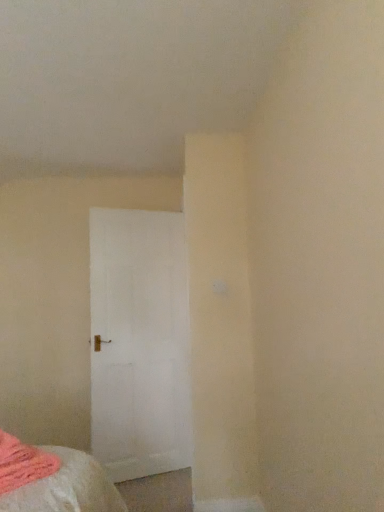
The image size is (384, 512). Describe the element at coordinates (139, 342) in the screenshot. I see `white matte door at center` at that location.

From the picture: What is the approximate height of white matte door at center?

white matte door at center is 6.52 feet tall.

Locate an element on the screen. The image size is (384, 512). white matte door at center is located at coordinates (139, 342).

Where is `soft pink fabric at lower left`? This screenshot has width=384, height=512. soft pink fabric at lower left is located at coordinates (23, 463).

What do you see at coordinates (23, 463) in the screenshot?
I see `soft pink fabric at lower left` at bounding box center [23, 463].

Where is `white matte door at center`? white matte door at center is located at coordinates (139, 342).

Does white matte door at center appear on the right side of soft pink fabric at lower left?

Correct, you'll find white matte door at center to the right of soft pink fabric at lower left.

Which object is closer to the camera, white matte door at center or soft pink fabric at lower left?

Positioned in front is soft pink fabric at lower left.

Between point (109, 231) and point (49, 459), which one is positioned behind?

The point (109, 231) is more distant.

From the image's perspective, is white matte door at center beneath soft pink fabric at lower left?

No, from the image's perspective, white matte door at center is not below soft pink fabric at lower left.

From a real-world perspective, is white matte door at center located higher than soft pink fabric at lower left?

Correct, in the physical world, white matte door at center is higher than soft pink fabric at lower left.

Between white matte door at center and soft pink fabric at lower left, which one has smaller width?

white matte door at center.

In the scene shown: Considering the sizes of objects white matte door at center and soft pink fabric at lower left in the image provided, who is shorter, white matte door at center or soft pink fabric at lower left?

soft pink fabric at lower left is shorter.

Considering the relative sizes of white matte door at center and soft pink fabric at lower left in the image provided, is white matte door at center bigger than soft pink fabric at lower left?

Yes.

Could soft pink fabric at lower left be considered to be inside white matte door at center?

No.

Is white matte door at center next to soft pink fabric at lower left and touching it?

No, white matte door at center is not next to soft pink fabric at lower left.

Could you tell me if white matte door at center is turned towards soft pink fabric at lower left?

No.

Can you tell me how much white matte door at center and soft pink fabric at lower left differ in facing direction?

The angle between the facing direction of white matte door at center and the facing direction of soft pink fabric at lower left is 68.6 degrees.

Measure the distance between white matte door at center and soft pink fabric at lower left.

They are 1.68 meters apart.

Find the location of `blanket lying in front of the white matte door at center`. blanket lying in front of the white matte door at center is located at coordinates (23, 463).

Is soft pink fabric at lower left to the left of white matte door at center from the viewer's perspective?

Indeed, soft pink fabric at lower left is positioned on the left side of white matte door at center.

Which object is closer to the camera, soft pink fabric at lower left or white matte door at center?

soft pink fabric at lower left is closer to the camera.

Which is closer to the camera, (36, 463) or (186, 449)?

Point (36, 463) is positioned closer to the camera compared to point (186, 449).

From the image's perspective, which object appears higher, soft pink fabric at lower left or white matte door at center?

From the image's view, white matte door at center is above.

From a real-world perspective, does soft pink fabric at lower left sit lower than white matte door at center?

Yes, from a real-world perspective, soft pink fabric at lower left is under white matte door at center.

Can you confirm if soft pink fabric at lower left is thinner than white matte door at center?

No.

Does soft pink fabric at lower left have a greater height compared to white matte door at center?

Incorrect, the height of soft pink fabric at lower left is not larger of that of white matte door at center.

Considering the relative sizes of soft pink fabric at lower left and white matte door at center in the image provided, is soft pink fabric at lower left bigger than white matte door at center?

Actually, soft pink fabric at lower left might be smaller than white matte door at center.

Is soft pink fabric at lower left situated inside white matte door at center or outside?

soft pink fabric at lower left is outside white matte door at center.

Are soft pink fabric at lower left and white matte door at center far apart?

Yes, soft pink fabric at lower left and white matte door at center are quite far apart.

Is soft pink fabric at lower left oriented away from white matte door at center?

Yes, soft pink fabric at lower left's orientation is away from white matte door at center.

Can you tell me how much soft pink fabric at lower left and white matte door at center differ in facing direction?

68.6 degrees.

At what (x,y) coordinates should I click in order to perform the action: click on blanket to the left of white matte door at center. Please return your answer as a coordinate pair (x, y). The height and width of the screenshot is (512, 384). Looking at the image, I should click on (23, 463).

There is a soft pink fabric at lower left. Identify the location of door above it (from a real-world perspective). (139, 342).

This screenshot has width=384, height=512. Find the location of `blanket to the left of white matte door at center`. blanket to the left of white matte door at center is located at coordinates (23, 463).